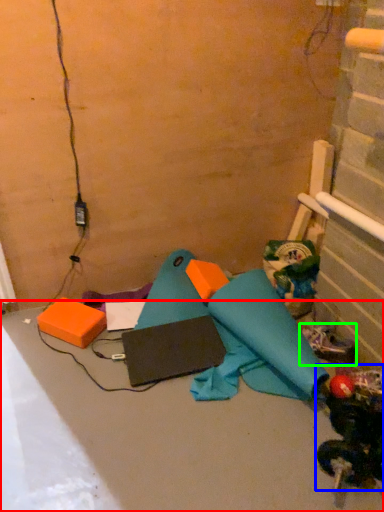
Question: Estimate the real-world distances between objects in this image. Which object is closer to concrete (highlighted by a red box), toy (highlighted by a blue box) or footwear (highlighted by a green box)?

Choices:
 (A) toy
 (B) footwear

Answer: (A)